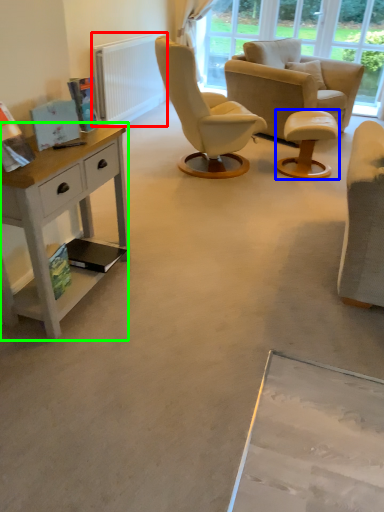
Question: Which object is positioned closest to radiator (highlighted by a red box)? Select from stool (highlighted by a blue box) and desk (highlighted by a green box).

Choices:
 (A) stool
 (B) desk

Answer: (A)